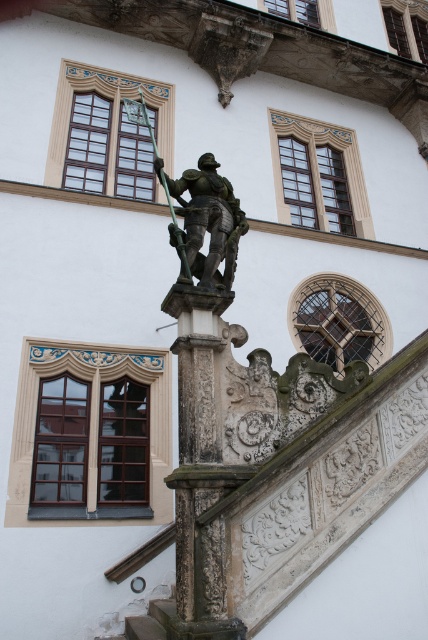
This screenshot has width=428, height=640. Find the location of `carved stone pillar at center`. carved stone pillar at center is located at coordinates (205, 456).

Is carved stone pillar at center positioned in front of shiny bronze knight at center?

That is True.

Who is more forward, (252, 472) or (228, 204)?

Point (252, 472) is more forward.

Locate an element on the screen. carved stone pillar at center is located at coordinates (205, 456).